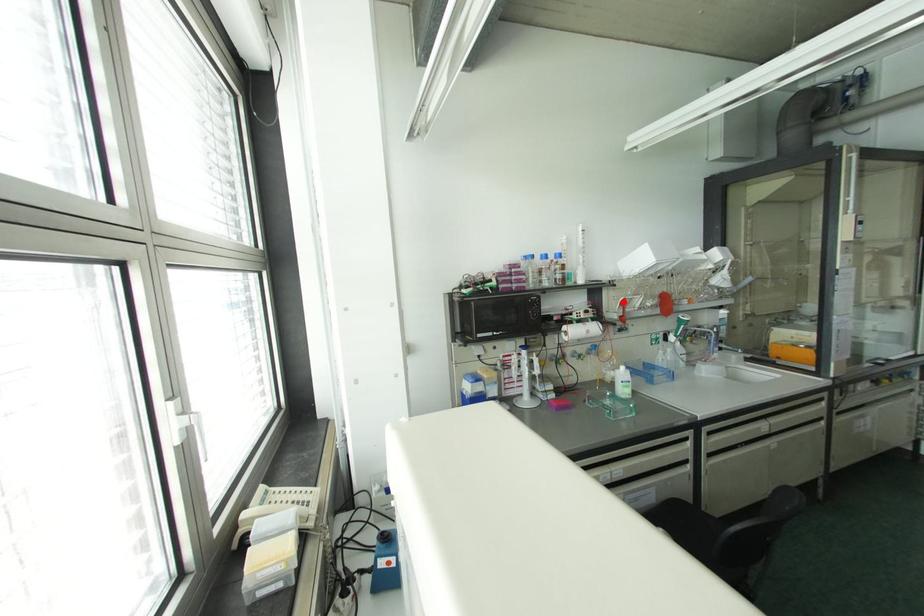
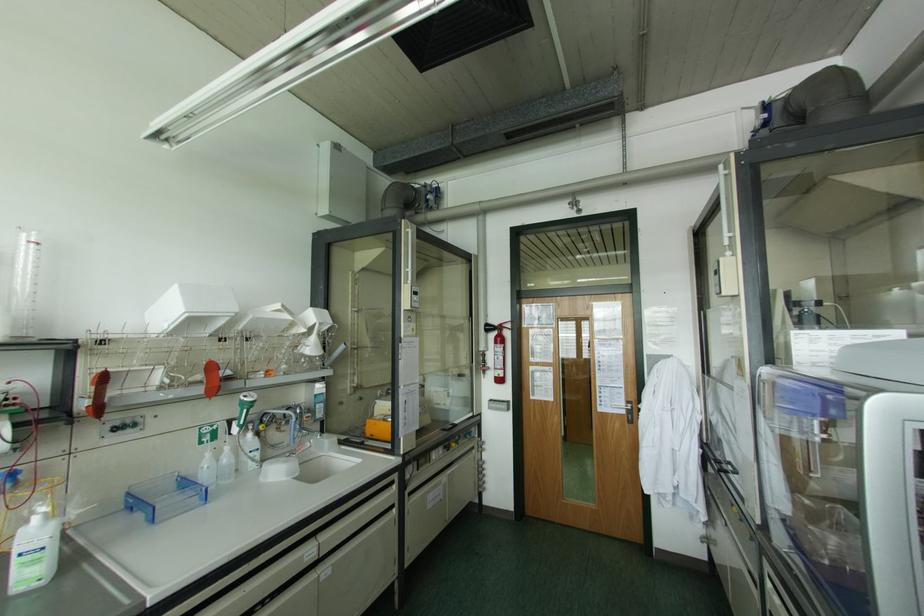
Find the pixel in the second image that matches the highlighted location in the first image.

(102, 379)